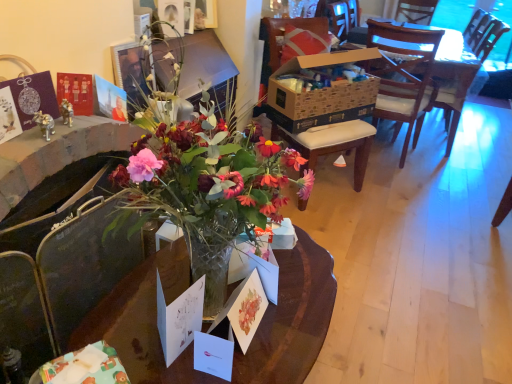
In order to click on free location to the right of matte paper postcard at center, the third postcard when ordered from left to right in this screenshot , I will do `click(291, 328)`.